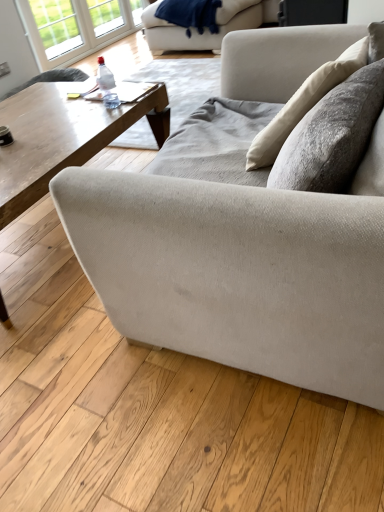
Question: Is point (162, 35) positioned closer to the camera than point (180, 0)?

Choices:
 (A) farther
 (B) closer

Answer: (A)

Question: Which is correct: beige fabric couch at upper center, placed as the first studio couch when sorted from back to front, is inside velvety blue blanket at upper center, or outside of it?

Choices:
 (A) outside
 (B) inside

Answer: (B)

Question: Which is farther from the white glass window at upper left, which is the 2th window in left-to-right order?

Choices:
 (A) textured beige couch at center, positioned as the 1th studio couch in front-to-back order
 (B) beige fabric couch at upper center, placed as the first studio couch when sorted from back to front
 (C) velvety blue blanket at upper center
 (D) wooden coffee table at center
 (E) clear glass window at upper left, the second window viewed from the right

Answer: (A)

Question: Estimate the real-world distances between objects in this image. Which object is closer to the white glass window at upper left, the first window in the right-to-left sequence?

Choices:
 (A) velvety blue blanket at upper center
 (B) beige fabric couch at upper center, which ranks as the second studio couch in bottom-to-top order
 (C) wooden coffee table at center
 (D) clear glass window at upper left, which is the first window from left to right
 (E) textured beige couch at center, positioned as the 1th studio couch in front-to-back order

Answer: (D)